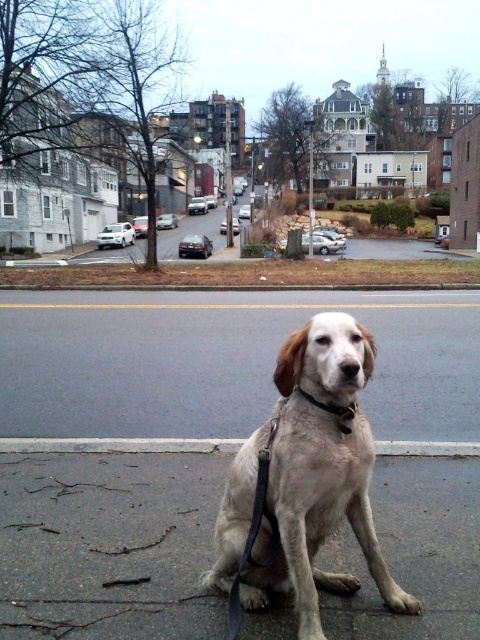
You are a delivery person trying to place a small package on the ground near the gray concrete curb at lower center and the black leather neckband at center. Based on their positions, can you place the package between them?

The gray concrete curb at lower center is below the black leather neckband at center, so placing the package between them would require positioning it above the curb and below the neckband. However, since the neckband is on the dog and the curb is on the ground, the package can be placed on the ground between them by placing it near the curb where the neckband is positioned.

You are a delivery person who needs to attach a new leash to the black leather neckband at center of the light brown fur dog at center. Given that the leash is 1.2 meters long, will the dog have enough space to move freely without the leash becoming taut?

The light brown fur dog at center is larger in size than the black leather neckband at center. Since the leash is 1.2 meters long, the dog should have sufficient space to move around freely without the leash tightening, as the length allows for comfortable movement for a dog of that size.

Looking at this image, you are a delivery person who needs to secure a package on the light brown fur dog at center using the black leather neckband at center. Can you attach the package to the neckband without it slipping off the dog?

The light brown fur dog at center is located below the black leather neckband at center, so the neckband is positioned higher up on the dog. This means the package can be secured to the neckband as it is above the dog, preventing it from slipping off.